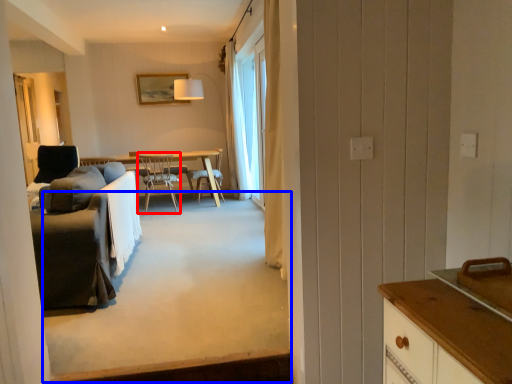
Question: Which object appears farthest to the camera in this image, chair (highlighted by a red box) or plain (highlighted by a blue box)?

Choices:
 (A) chair
 (B) plain

Answer: (A)